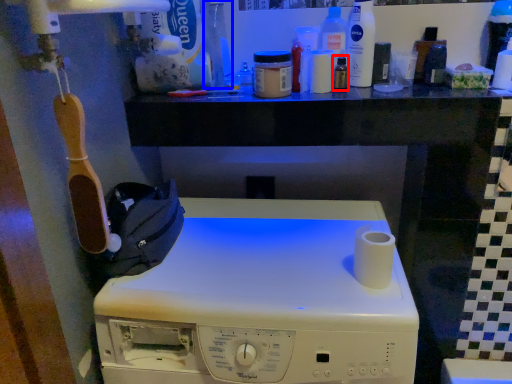
Question: Which object appears farthest to the camera in this image, toiletry (highlighted by a red box) or bottle (highlighted by a blue box)?

Choices:
 (A) toiletry
 (B) bottle

Answer: (A)